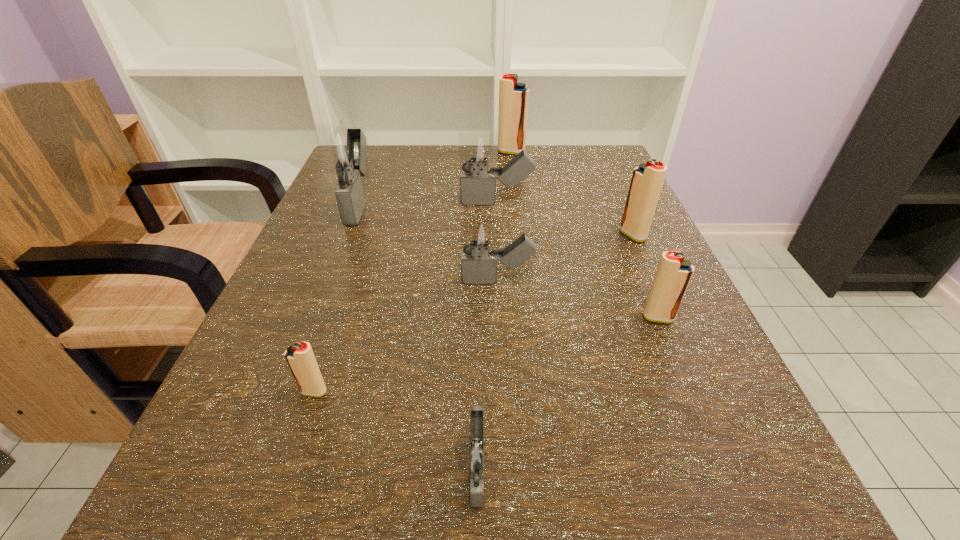
Where is `the leftmost red igniter`? the leftmost red igniter is located at coordinates (300, 357).

Image resolution: width=960 pixels, height=540 pixels. Find the location of `the nearest gray igniter`. the nearest gray igniter is located at coordinates (476, 455).

I want to click on the smallest gray igniter, so click(476, 455).

Where is `free space located 0.270m on the left of the second red igniter from left to right`? This screenshot has width=960, height=540. free space located 0.270m on the left of the second red igniter from left to right is located at coordinates (386, 152).

Identify the location of vacant space located on the front of the biggest gray igniter. This screenshot has width=960, height=540. pos(322,302).

In order to click on vacant area situated on the front of the second biggest red igniter in this screenshot , I will do `click(644, 261)`.

The height and width of the screenshot is (540, 960). I want to click on vacant space situated 0.110m on the front of the second biggest gray igniter, so click(x=499, y=247).

The width and height of the screenshot is (960, 540). What are the coordinates of `free point located 0.180m on the left of the second smallest gray igniter` in the screenshot? It's located at (350, 281).

I want to click on vacant area situated 0.250m on the left of the second smallest red igniter, so click(473, 318).

This screenshot has width=960, height=540. In order to click on vacant space located 0.130m on the right of the smallest red igniter in this screenshot , I will do `click(430, 392)`.